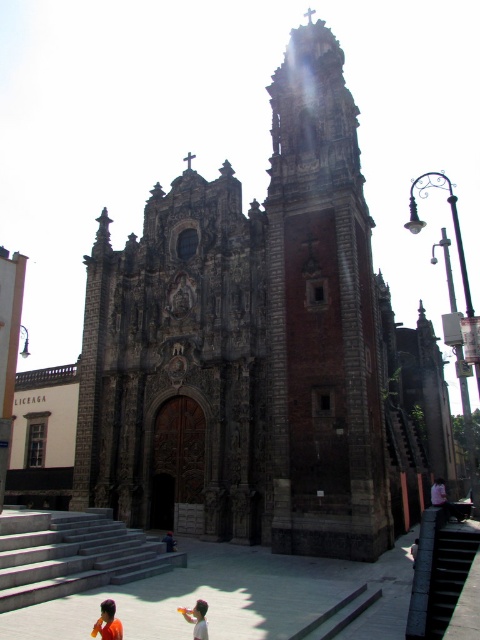
Who is shorter, gray concrete stairs at lower left or orange fabric person at lower center?

With less height is orange fabric person at lower center.

Between point (137, 572) and point (168, 547), which one is positioned in front?

Positioned in front is point (137, 572).

This screenshot has height=640, width=480. Find the location of `gray concrete stairs at lower left`. gray concrete stairs at lower left is located at coordinates (72, 556).

Locate an element on the screen. The image size is (480, 640). gray concrete stairs at lower left is located at coordinates [72, 556].

Which is more to the left, orange fabric at lower center or orange fabric person at lower center?

orange fabric at lower center is more to the left.

Based on the photo, can you confirm if orange fabric at lower center is positioned above orange fabric person at lower center?

Yes, orange fabric at lower center is above orange fabric person at lower center.

Is point (107, 605) in front of point (164, 541)?

Yes.

This screenshot has width=480, height=640. I want to click on orange fabric at lower center, so click(108, 621).

In the scene shown: Does light yellow fabric at lower center have a smaller size compared to light blue shirt at lower right?

Indeed, light yellow fabric at lower center has a smaller size compared to light blue shirt at lower right.

Is light yellow fabric at lower center wider than light blue shirt at lower right?

Incorrect, light yellow fabric at lower center's width does not surpass light blue shirt at lower right's.

Find the location of a particular element. light yellow fabric at lower center is located at coordinates (196, 618).

Where is `light yellow fabric at lower center`? light yellow fabric at lower center is located at coordinates pos(196,618).